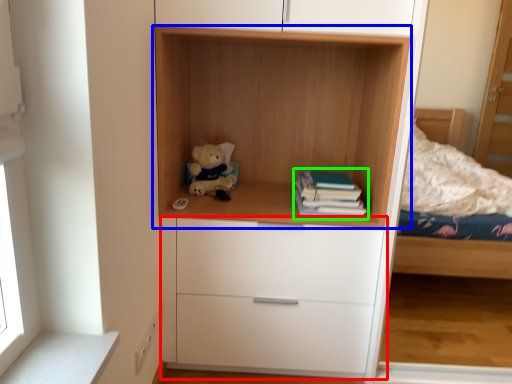
Question: Estimate the real-world distances between objects in this image. Which object is farther from chest of drawers (highlighted by a red box), shelf (highlighted by a blue box) or paperback book (highlighted by a green box)?

Choices:
 (A) shelf
 (B) paperback book

Answer: (A)